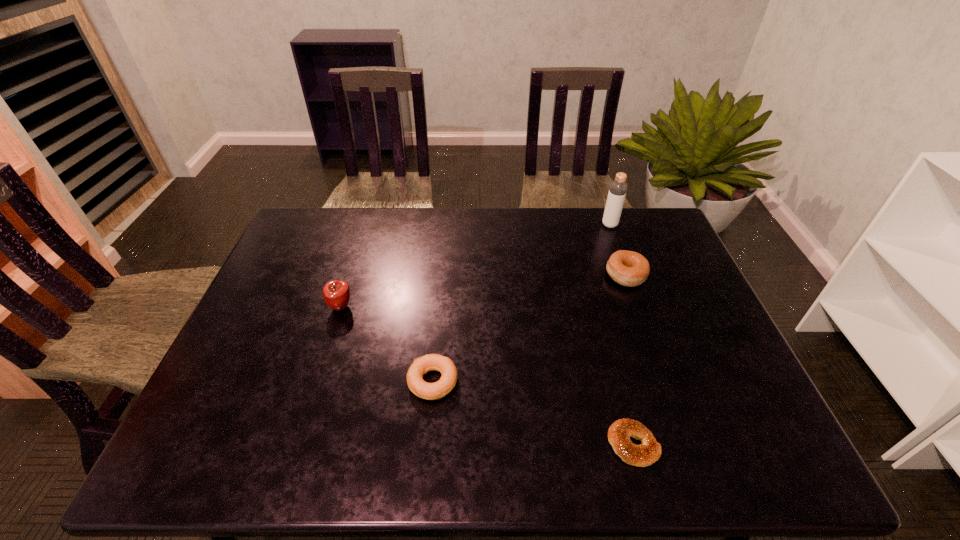
You are a GUI agent. You are given a task and a screenshot of the screen. Output one action in this format:
    pyautogui.click(x=<x>, y=<y>)
    Task: Click on the vacant space located 0.260m on the front of the tallest object
    Image resolution: width=960 pixels, height=540 pixels.
    Given the screenshot: What is the action you would take?
    pyautogui.click(x=631, y=282)

This screenshot has width=960, height=540. Identify the location of vacant region located on the left of the apple. [307, 307].

Image resolution: width=960 pixels, height=540 pixels. What are the coordinates of `vacant region located on the left of the third shortest object` in the screenshot? It's located at (522, 275).

Locate an element on the screen. The height and width of the screenshot is (540, 960). free space located 0.060m on the left of the second shortest bagel is located at coordinates (383, 382).

This screenshot has height=540, width=960. Find the location of `vacant space situated on the right of the nearest object`. vacant space situated on the right of the nearest object is located at coordinates (752, 444).

Identify the location of object present at the far edge. This screenshot has height=540, width=960. (617, 192).

Locate an element on the screen. object that is at the near edge is located at coordinates (619, 433).

Identify the location of bottle at the right edge. (617, 192).

This screenshot has height=540, width=960. Identify the location of bagel at the right edge. (628, 268).

This screenshot has height=540, width=960. In order to click on object present at the far right corner in this screenshot , I will do `click(617, 192)`.